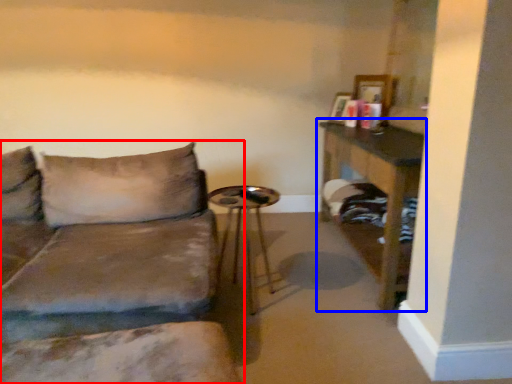
Question: Which point is further to the camera, studio couch (highlighted by a red box) or table (highlighted by a blue box)?

Choices:
 (A) studio couch
 (B) table

Answer: (B)